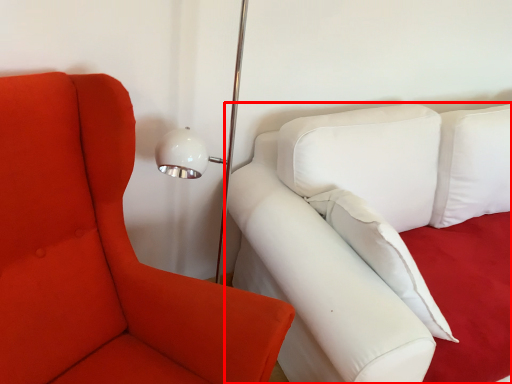
Question: From the image's perspective, where is studio couch (annotated by the red box) located in relation to chair in the image?

Choices:
 (A) below
 (B) above

Answer: (B)